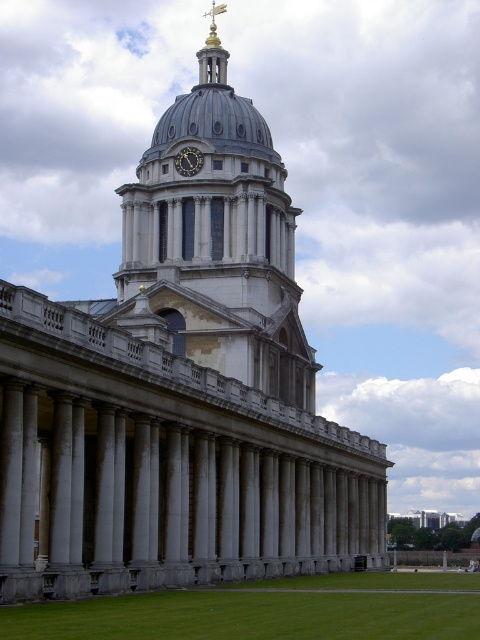
Who is higher up, gray stone dome at center or gold metallic clock at center?

Positioned higher is gold metallic clock at center.

Does point (289, 234) lie in front of point (182, 160)?

That is False.

The width and height of the screenshot is (480, 640). In order to click on gray stone dome at center in this screenshot , I will do `click(219, 237)`.

Does green grass at lower center appear under gold metallic clock at center?

Correct, green grass at lower center is located below gold metallic clock at center.

Is point (73, 621) in front of point (180, 161)?

That is True.

This screenshot has height=640, width=480. Find the location of `green grass at lower center`. green grass at lower center is located at coordinates (268, 611).

Is gray stone dome at center bigger than green grass at lower center?

No, gray stone dome at center is not bigger than green grass at lower center.

Image resolution: width=480 pixels, height=640 pixels. I want to click on gray stone dome at center, so click(219, 237).

Locate an element on the screen. The height and width of the screenshot is (640, 480). gray stone dome at center is located at coordinates (219, 237).